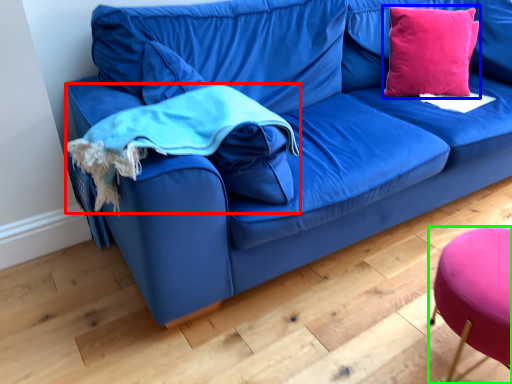
Question: Which object is positioned farthest from cloth (highlighted by a red box)? Select from throw pillow (highlighted by a blue box) and stool (highlighted by a green box).

Choices:
 (A) throw pillow
 (B) stool

Answer: (A)